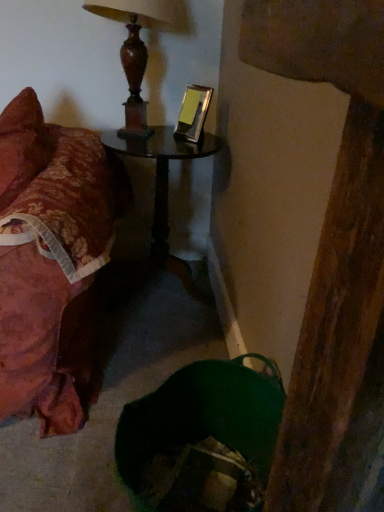
Question: Does black glass table at center have a lesser height compared to floral fabric bed at left?

Choices:
 (A) yes
 (B) no

Answer: (A)

Question: From a real-world perspective, is black glass table at center physically above floral fabric bed at left?

Choices:
 (A) no
 (B) yes

Answer: (A)

Question: Considering the relative sizes of black glass table at center and floral fabric bed at left in the image provided, is black glass table at center wider than floral fabric bed at left?

Choices:
 (A) no
 (B) yes

Answer: (A)

Question: From the image's perspective, would you say black glass table at center is shown under floral fabric bed at left?

Choices:
 (A) no
 (B) yes

Answer: (A)

Question: Does black glass table at center have a larger size compared to floral fabric bed at left?

Choices:
 (A) yes
 (B) no

Answer: (B)

Question: Is black glass table at center taller than floral fabric bed at left?

Choices:
 (A) no
 (B) yes

Answer: (A)

Question: Does wooden lamp at upper center lie behind floral fabric bed at left?

Choices:
 (A) no
 (B) yes

Answer: (B)

Question: Does wooden lamp at upper center have a lesser width compared to floral fabric bed at left?

Choices:
 (A) yes
 (B) no

Answer: (A)

Question: Could you tell me if wooden lamp at upper center is facing floral fabric bed at left?

Choices:
 (A) yes
 (B) no

Answer: (B)

Question: From the image's perspective, is wooden lamp at upper center beneath floral fabric bed at left?

Choices:
 (A) yes
 (B) no

Answer: (B)

Question: Is wooden lamp at upper center to the left of floral fabric bed at left from the viewer's perspective?

Choices:
 (A) yes
 (B) no

Answer: (B)

Question: Is wooden lamp at upper center not within floral fabric bed at left?

Choices:
 (A) no
 (B) yes

Answer: (B)

Question: Is floral fabric bed at left further to the viewer compared to black glass table at center?

Choices:
 (A) no
 (B) yes

Answer: (A)